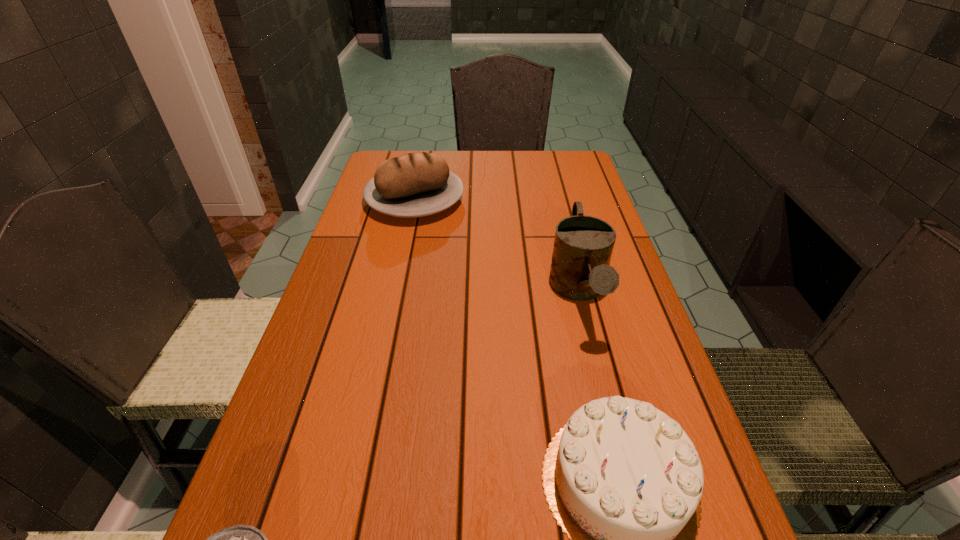
At what (x,y) coordinates should I click in order to perform the action: click on watering can. Please return your answer as a coordinate pair (x, y). The width and height of the screenshot is (960, 540). Looking at the image, I should click on (583, 245).

Identify the location of the third nearest object. The height and width of the screenshot is (540, 960). (583, 245).

This screenshot has height=540, width=960. I want to click on the farthest object, so click(420, 184).

Find the location of a particular element. The width and height of the screenshot is (960, 540). free location located with the spout on the second farthest object is located at coordinates (631, 501).

Identify the location of vacant space located on the right of the farthest object. The width and height of the screenshot is (960, 540). (499, 200).

Find the location of a particular element. This screenshot has height=540, width=960. object that is at the far edge is located at coordinates (420, 184).

The width and height of the screenshot is (960, 540). What are the coordinates of `object that is positioned at the left edge` in the screenshot? It's located at (420, 184).

Find the location of `object that is at the right edge`. object that is at the right edge is located at coordinates (583, 245).

Locate an element on the screen. The image size is (960, 540). object located in the far left corner section of the desktop is located at coordinates (420, 184).

In the image, there is a desktop. Where is `free region at the far edge`? free region at the far edge is located at coordinates (451, 172).